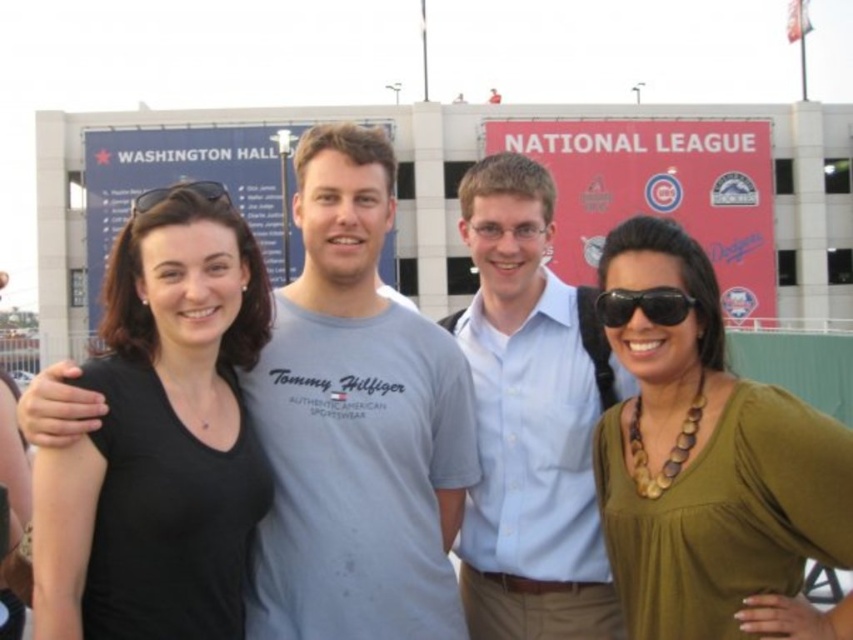
Is black plastic sunglasses at lower right smaller than matte black sunglasses at left?

Yes, black plastic sunglasses at lower right is smaller than matte black sunglasses at left.

Does black plastic sunglasses at lower right have a greater width compared to matte black sunglasses at left?

No.

From the picture: Who is more distant from viewer, (659, 320) or (192, 188)?

Positioned behind is point (192, 188).

Locate an element on the screen. This screenshot has height=640, width=853. black plastic sunglasses at lower right is located at coordinates (643, 305).

Who is shorter, light gray cotton t-shirt at center or light blue shirt at center?

light gray cotton t-shirt at center is shorter.

Measure the distance between light gray cotton t-shirt at center and light blue shirt at center.

light gray cotton t-shirt at center is 6.07 meters from light blue shirt at center.

What do you see at coordinates (357, 422) in the screenshot?
I see `light gray cotton t-shirt at center` at bounding box center [357, 422].

Locate an element on the screen. Image resolution: width=853 pixels, height=640 pixels. light gray cotton t-shirt at center is located at coordinates (357, 422).

Between green fabric shirt at right and matte black sunglasses at left, which one has less height?

Standing shorter between the two is matte black sunglasses at left.

What do you see at coordinates (706, 460) in the screenshot? I see `green fabric shirt at right` at bounding box center [706, 460].

Where is `green fabric shirt at right`? green fabric shirt at right is located at coordinates [706, 460].